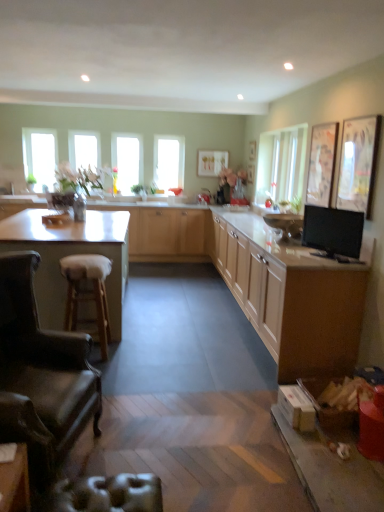
Question: Is light wood cabinet at center, which appears as the first cabinetry when viewed from the back, taller than leather armchair at lower left?

Choices:
 (A) yes
 (B) no

Answer: (B)

Question: Is light wood cabinet at center, which appears as the first cabinetry when viewed from the back, oriented away from leather armchair at lower left?

Choices:
 (A) no
 (B) yes

Answer: (A)

Question: Is light wood cabinet at center, which appears as the first cabinetry when viewed from the back, to the left of leather armchair at lower left from the viewer's perspective?

Choices:
 (A) no
 (B) yes

Answer: (B)

Question: Is light wood cabinet at center, which appears as the first cabinetry when viewed from the back, not inside leather armchair at lower left?

Choices:
 (A) yes
 (B) no

Answer: (A)

Question: Can you confirm if light wood cabinet at center, which appears as the first cabinetry when viewed from the back, is wider than leather armchair at lower left?

Choices:
 (A) no
 (B) yes

Answer: (A)

Question: From a real-world perspective, is light wood cabinet at center, marked as the third cabinetry in a front-to-back arrangement, positioned over leather armchair at lower left based on gravity?

Choices:
 (A) yes
 (B) no

Answer: (B)

Question: Considering the relative sizes of light wood cabinet at right, which is the 2th cabinetry from back to front, and white laminate countertop at left in the image provided, is light wood cabinet at right, which is the 2th cabinetry from back to front, wider than white laminate countertop at left?

Choices:
 (A) no
 (B) yes

Answer: (A)

Question: Can you confirm if light wood cabinet at right, which is the 2th cabinetry from back to front, is taller than white laminate countertop at left?

Choices:
 (A) no
 (B) yes

Answer: (A)

Question: Is light wood cabinet at right, which ranks as the 2th cabinetry in front-to-back order, not within white laminate countertop at left?

Choices:
 (A) no
 (B) yes

Answer: (B)

Question: Does light wood cabinet at right, which is the 2th cabinetry from back to front, have a larger size compared to white laminate countertop at left?

Choices:
 (A) no
 (B) yes

Answer: (A)

Question: Would you consider light wood cabinet at right, which ranks as the 2th cabinetry in front-to-back order, to be distant from white laminate countertop at left?

Choices:
 (A) no
 (B) yes

Answer: (B)

Question: From a real-world perspective, is light wood cabinet at right, which ranks as the 2th cabinetry in front-to-back order, under white laminate countertop at left?

Choices:
 (A) no
 (B) yes

Answer: (B)

Question: Considering the relative sizes of matte wood cabinets at center, marked as the 1th cabinetry in a front-to-back arrangement, and black glossy tv at right in the image provided, is matte wood cabinets at center, marked as the 1th cabinetry in a front-to-back arrangement, bigger than black glossy tv at right?

Choices:
 (A) no
 (B) yes

Answer: (B)